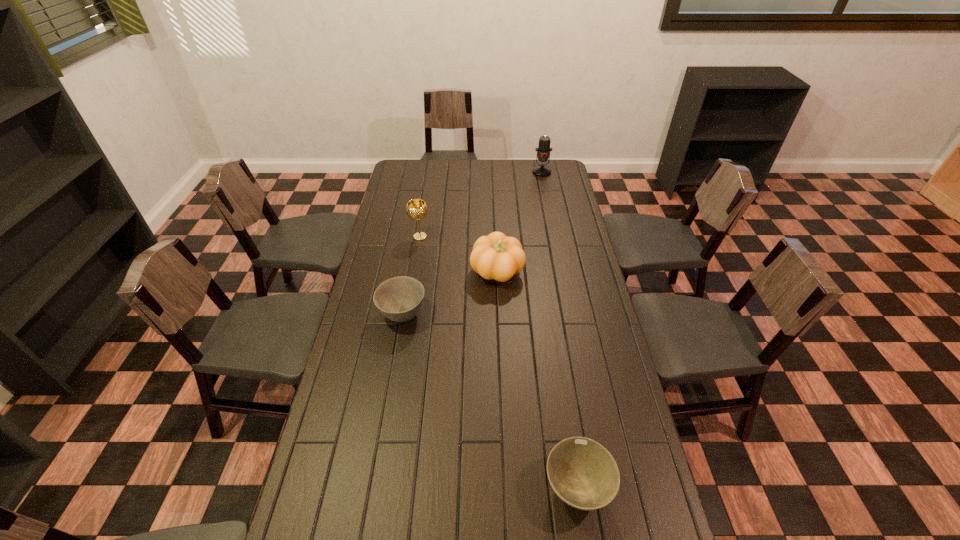
Where is `vacant area situated on the front of the farther bowl`? vacant area situated on the front of the farther bowl is located at coordinates (391, 379).

The image size is (960, 540). What are the coordinates of `vacant region located on the back of the nearer bowl` in the screenshot? It's located at (562, 388).

Find the location of a particular element. This screenshot has width=960, height=540. object at the far edge is located at coordinates (543, 151).

Locate an element on the screen. Image resolution: width=960 pixels, height=540 pixels. chalice at the left edge is located at coordinates (416, 209).

At what (x,y) coordinates should I click in order to perform the action: click on bowl that is at the left edge. Please return your answer as a coordinate pair (x, y). This screenshot has height=540, width=960. Looking at the image, I should click on (399, 299).

The height and width of the screenshot is (540, 960). What are the coordinates of `microphone that is at the right edge` in the screenshot? It's located at (543, 151).

The image size is (960, 540). I want to click on bowl present at the right edge, so click(583, 474).

You are a GUI agent. You are given a task and a screenshot of the screen. Output one action in this format:
    pyautogui.click(x=<x>, y=<y>)
    Task: Click on the object located at the far right corner
    This screenshot has height=540, width=960.
    Given the screenshot: What is the action you would take?
    pyautogui.click(x=543, y=151)

Locate an element on the screen. The width and height of the screenshot is (960, 540). vacant space at the far edge is located at coordinates (480, 170).

You are a GUI agent. You are given a task and a screenshot of the screen. Output one action in this format:
    pyautogui.click(x=<x>, y=<y>)
    Task: Click on the vacant space at the left edge
    This screenshot has height=540, width=960.
    Given the screenshot: What is the action you would take?
    pyautogui.click(x=397, y=195)